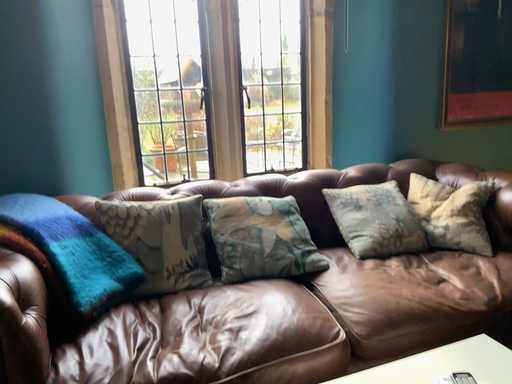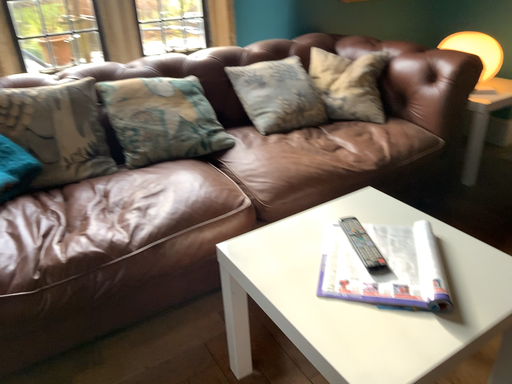
Question: Which way did the camera rotate in the video?

Choices:
 (A) rotated downward
 (B) rotated upward

Answer: (A)